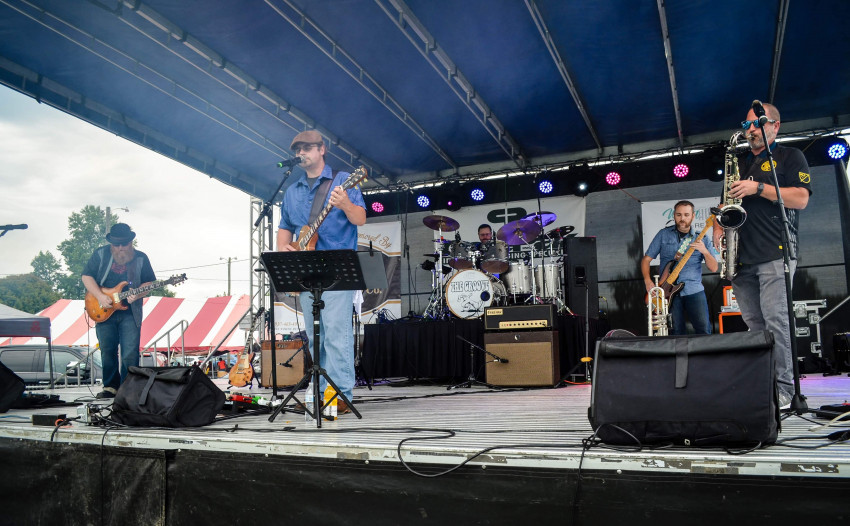
The height and width of the screenshot is (526, 850). I want to click on stage, so click(434, 412).